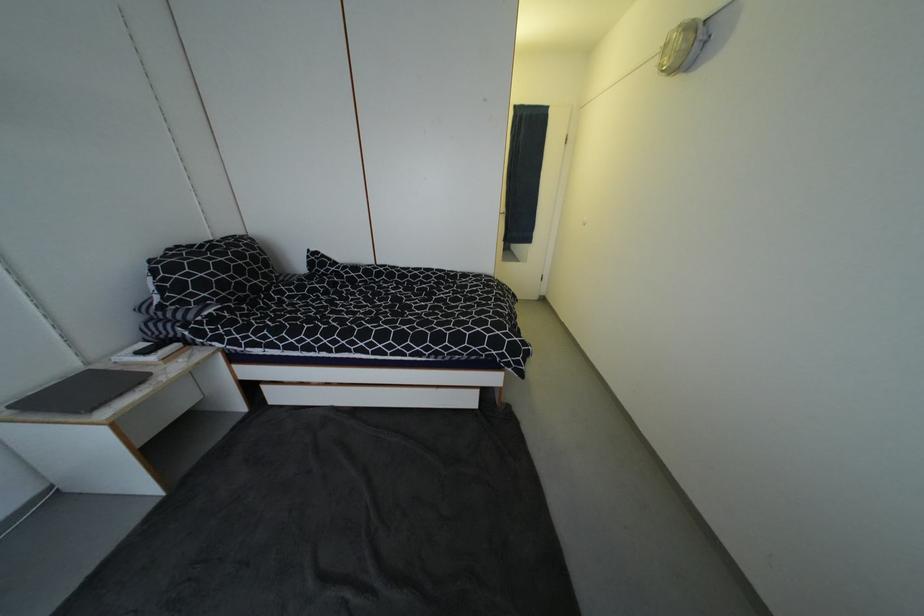
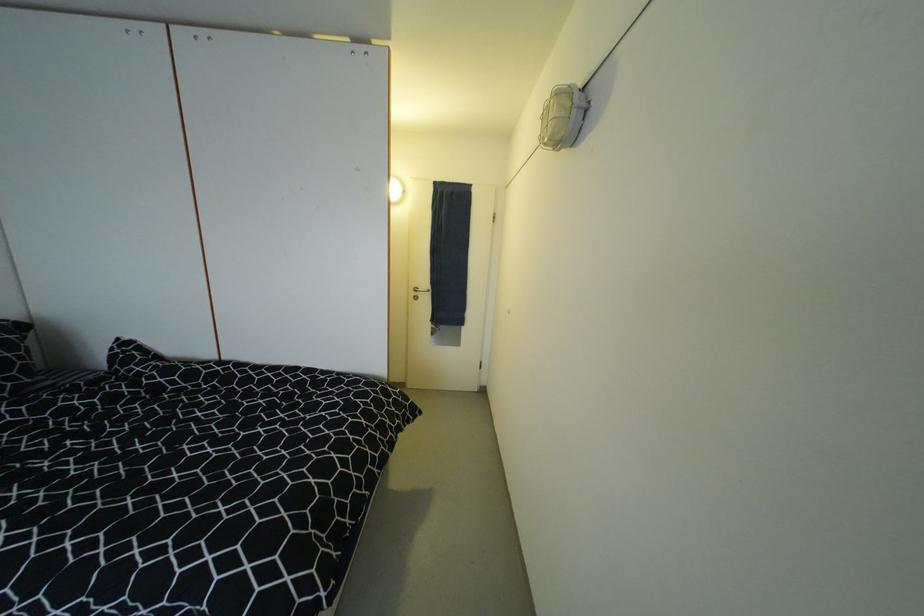
Question: The first image is from the beginning of the video and the second image is from the end. How did the camera likely rotate when shooting the video?

Choices:
 (A) Left
 (B) Right
 (C) Up
 (D) Down

Answer: (C)